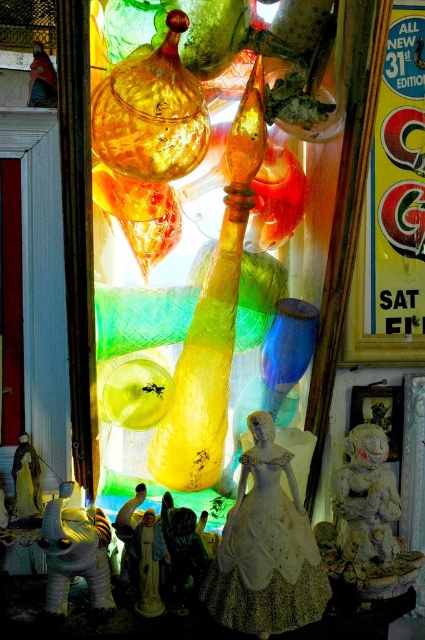
You are a customer in a vintage store and see the white lace dress at center and the white matte elephant at lower left. Which item is located to the right of the other?

The white lace dress at center is positioned on the right side of white matte elephant at lower left.

In the scene shown: You are standing in front of a display of vintage items and want to pick up the white matte elephant at lower left. If your hand can reach up to 1 meter, can you grab it without moving your position?

The white matte elephant at lower left is 1.01 meters away from the viewer, so your hand cannot reach it since it is slightly farther than 1 meter.

You are a customer in a vintage shop and want to pick up the white lace dress at center and the white matte elephant at lower left. Which object should you reach for first to grab both without moving your position?

You should reach for the white lace dress at center first because it is closer to you than the white matte elephant at lower left, so you can grab it first without moving your position.